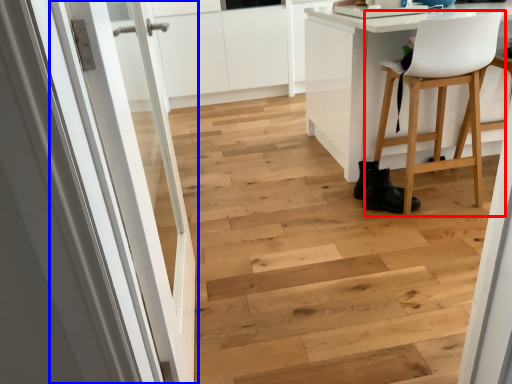
Question: Which object is closer to the camera taking this photo, chair (highlighted by a red box) or door (highlighted by a blue box)?

Choices:
 (A) chair
 (B) door

Answer: (B)